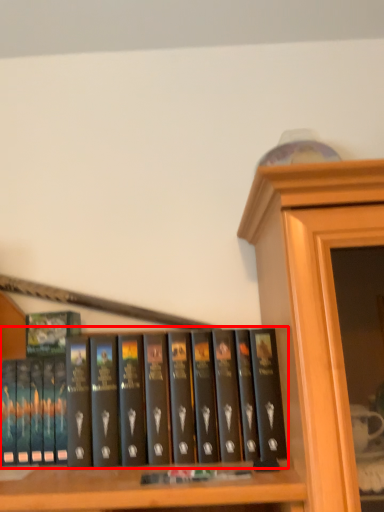
Question: From the image's perspective, where is book (annotated by the red box) located relative to book cover?

Choices:
 (A) above
 (B) below

Answer: (B)